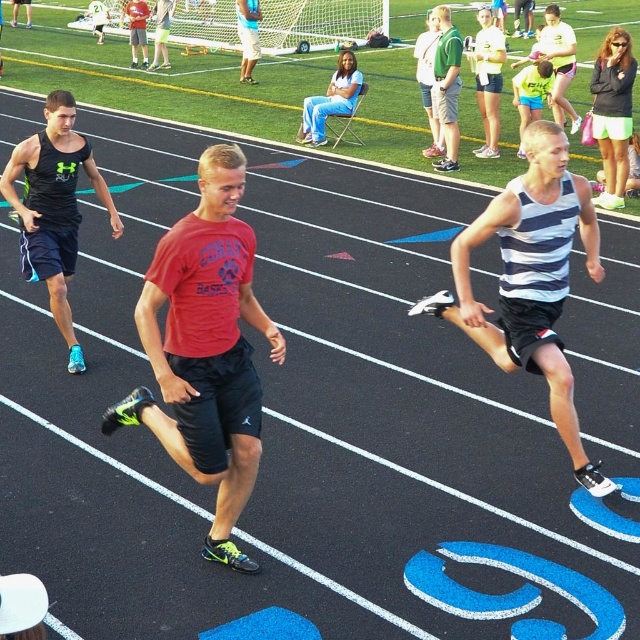
The height and width of the screenshot is (640, 640). Describe the element at coordinates (52, 208) in the screenshot. I see `matte black tank top at left` at that location.

From the picture: Which is below, matte black tank top at left or blue jeans at center?

Positioned lower is matte black tank top at left.

Does point (40, 234) lie in front of point (348, 100)?

Yes, point (40, 234) is closer to viewer.

Find the location of a particular element. This screenshot has height=640, width=640. matte black tank top at left is located at coordinates (52, 208).

Which of these two, striped tank top at right or matte red shirt at center, stands taller?

striped tank top at right

At what (x,y) coordinates should I click in order to perform the action: click on striped tank top at right. Please return your answer as a coordinate pair (x, y). Looking at the image, I should click on tap(531, 280).

Is red matte t-shirt at center above matte black tank top at left?

No.

From the picture: Can you confirm if red matte t-shirt at center is positioned to the left of matte black tank top at left?

In fact, red matte t-shirt at center is to the right of matte black tank top at left.

Where is `red matte t-shirt at center`? This screenshot has height=640, width=640. red matte t-shirt at center is located at coordinates (205, 348).